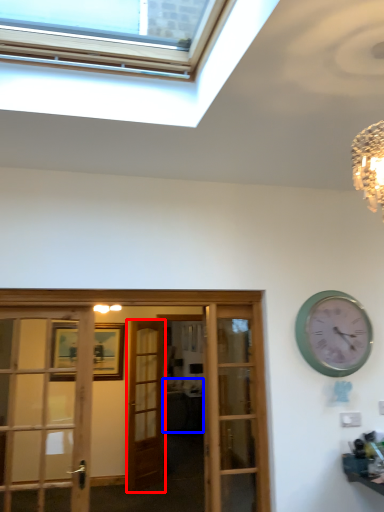
Question: Among these objects, which one is nearest to the camera, door (highlighted by a red box) or studio couch (highlighted by a blue box)?

Choices:
 (A) door
 (B) studio couch

Answer: (A)